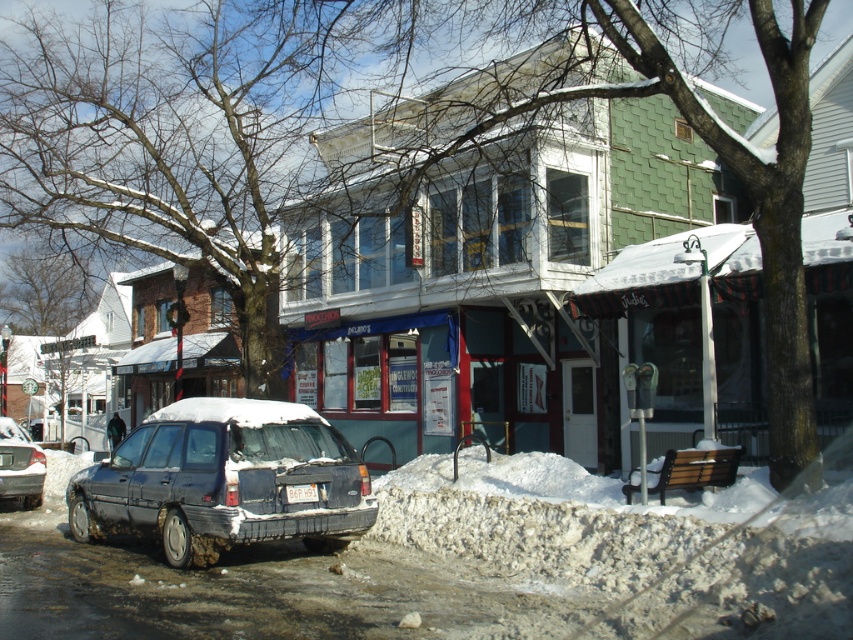
You are a delivery person trying to park your van near the blue painted storefront at center and the matte gray station wagon at lower left. Based on their positions, which object is closer to the right side of the street?

The blue painted storefront at center is positioned on the right side of matte gray station wagon at lower left, so the blue painted storefront at center is closer to the right side of the street.